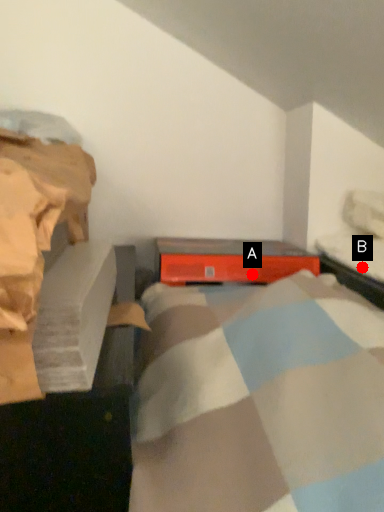
Question: Two points are circled on the image, labeled by A and B beside each circle. Which point appears closest to the camera in this image?

Choices:
 (A) A is closer
 (B) B is closer

Answer: (B)